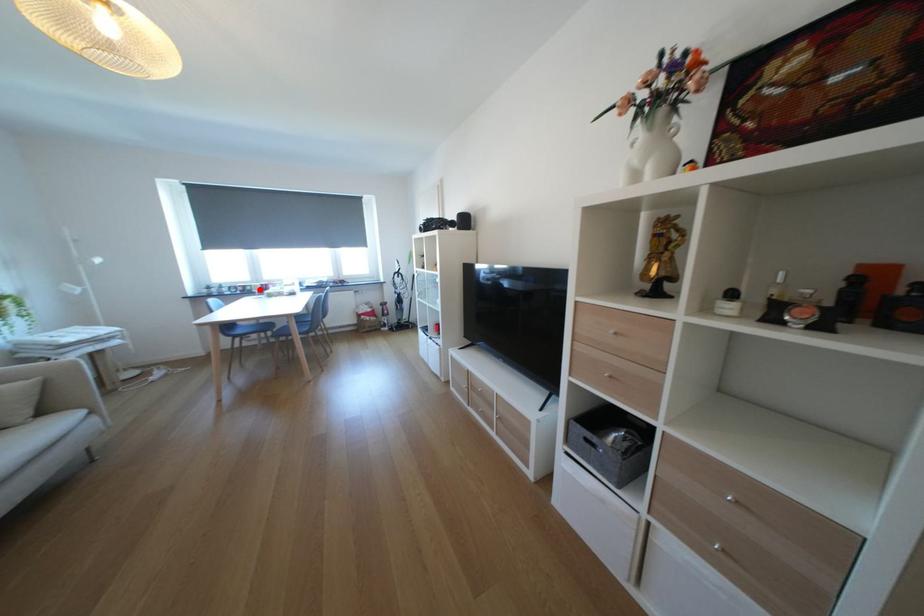
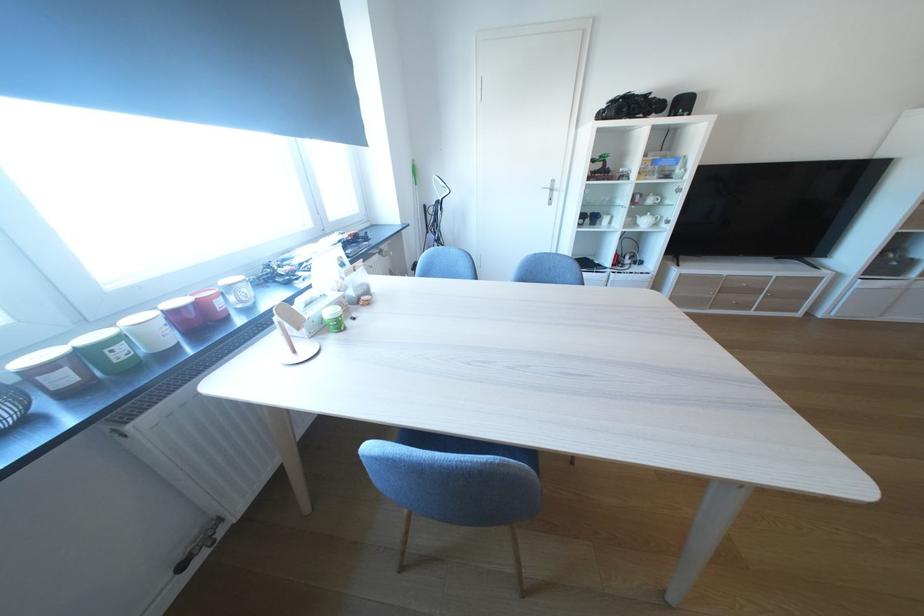
In the second image, find the point that corresponds to the highlighted location in the first image.

(129, 354)